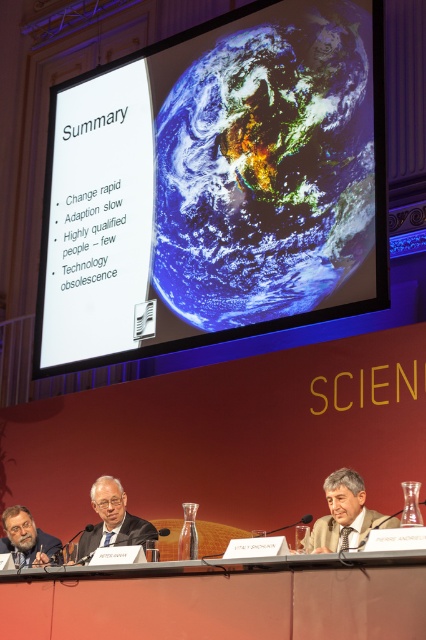
Question: Is matte wood table at lower center thinner than matte black man at center?

Choices:
 (A) no
 (B) yes

Answer: (B)

Question: Among these points, which one is nearest to the camera?

Choices:
 (A) (287, 560)
 (B) (89, 538)
 (C) (353, 497)

Answer: (A)

Question: Which point is farther to the camera?

Choices:
 (A) matte wood table at lower center
 (B) white paper at center
 (C) matte black suit at center

Answer: (B)

Question: Can you confirm if white paper at center is positioned below matte wood table at lower center?

Choices:
 (A) no
 (B) yes

Answer: (A)

Question: Does matte black man at center appear on the right side of gray hair at lower left?

Choices:
 (A) no
 (B) yes

Answer: (B)

Question: Which object appears closest to the camera in this image?

Choices:
 (A) gray hair at lower left
 (B) white paper at center
 (C) matte wood table at lower center
 (D) matte black suit at center

Answer: (C)